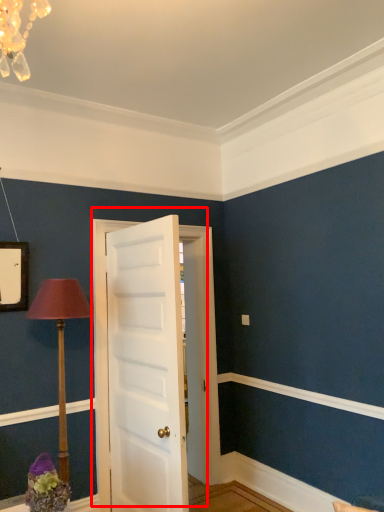
Question: Observing the image, what is the correct spatial positioning of door (annotated by the red box) in reference to table lamp?

Choices:
 (A) right
 (B) left

Answer: (A)